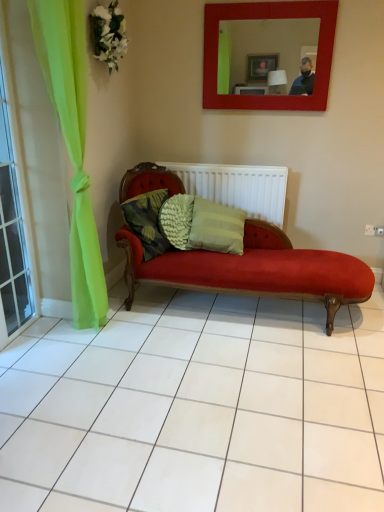
Question: Is matte red mirror at upper center wider than white textured radiator at center?

Choices:
 (A) no
 (B) yes

Answer: (A)

Question: Is matte red mirror at upper center positioned behind white textured radiator at center?

Choices:
 (A) yes
 (B) no

Answer: (B)

Question: From the image's perspective, is matte red mirror at upper center located above white textured radiator at center?

Choices:
 (A) yes
 (B) no

Answer: (A)

Question: From a real-world perspective, does matte red mirror at upper center sit lower than white textured radiator at center?

Choices:
 (A) no
 (B) yes

Answer: (A)

Question: Can you confirm if matte red mirror at upper center is thinner than white textured radiator at center?

Choices:
 (A) no
 (B) yes

Answer: (B)

Question: From the image's perspective, is matte red mirror at upper center above or below textured green pillow at center?

Choices:
 (A) above
 (B) below

Answer: (A)

Question: Is matte red mirror at upper center spatially inside textured green pillow at center, or outside of it?

Choices:
 (A) inside
 (B) outside

Answer: (B)

Question: In terms of width, does matte red mirror at upper center look wider or thinner when compared to textured green pillow at center?

Choices:
 (A) wide
 (B) thin

Answer: (B)

Question: Relative to textured green pillow at center, is matte red mirror at upper center in front or behind?

Choices:
 (A) front
 (B) behind

Answer: (B)

Question: In terms of height, does white textured radiator at center look taller or shorter compared to white fabric flower at upper left?

Choices:
 (A) tall
 (B) short

Answer: (A)

Question: Is white textured radiator at center wider or thinner than white fabric flower at upper left?

Choices:
 (A) thin
 (B) wide

Answer: (A)

Question: Do you think white textured radiator at center is within white fabric flower at upper left, or outside of it?

Choices:
 (A) outside
 (B) inside

Answer: (A)

Question: In terms of size, does white textured radiator at center appear bigger or smaller than white fabric flower at upper left?

Choices:
 (A) small
 (B) big

Answer: (B)

Question: Based on their positions, is textured green pillow at center located to the left or right of white fabric flower at upper left?

Choices:
 (A) right
 (B) left

Answer: (A)

Question: Is textured green pillow at center taller or shorter than white fabric flower at upper left?

Choices:
 (A) short
 (B) tall

Answer: (A)